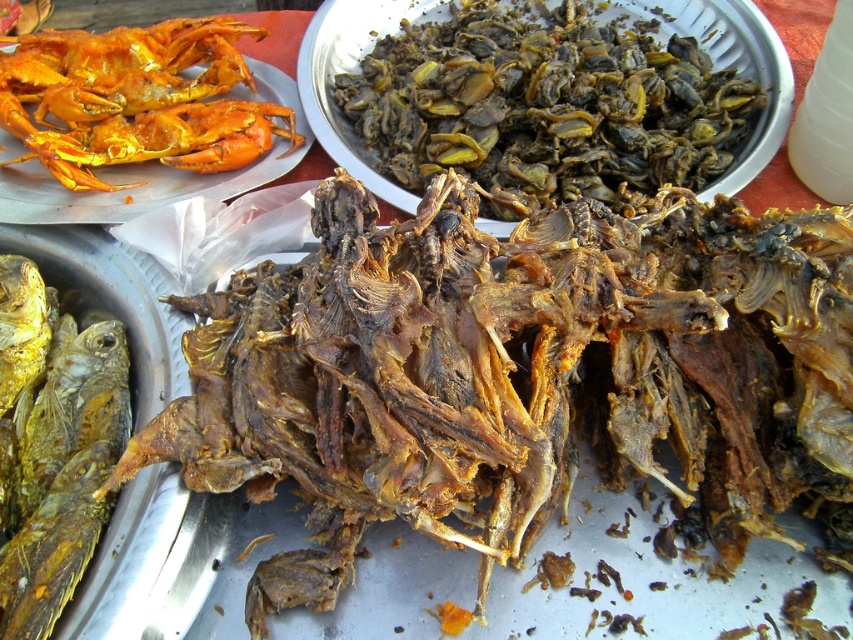
You are a food vendor at a market and want to stack the brown crispy insects at upper center and the golden crispy crab at upper left on a shelf. Which one should you place at the bottom to prevent the top item from falling off?

Place the brown crispy insects at upper center at the bottom because it is much taller than the golden crispy crab at upper left, so it can support the weight better.

You are a food critic holding a ruler and standing 3 feet away from the brown crispy fish at center. Can you accurately measure its length with your ruler?

The brown crispy fish at center is 33.16 inches away from the camera. Since you are standing 3 feet away, which is 36 inches, you are close enough to accurately measure its length with your ruler.